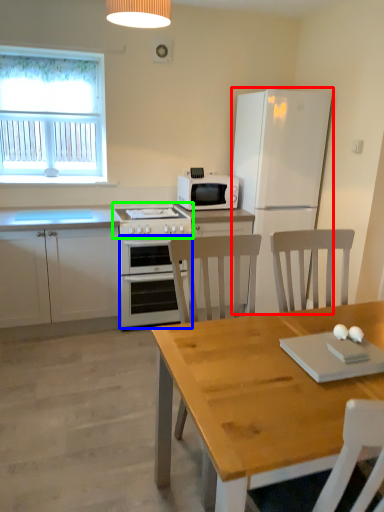
Question: Which is nearer to the refrigerator (highlighted by a red box)? oven (highlighted by a blue box) or gas stove (highlighted by a green box).

Choices:
 (A) oven
 (B) gas stove

Answer: (B)